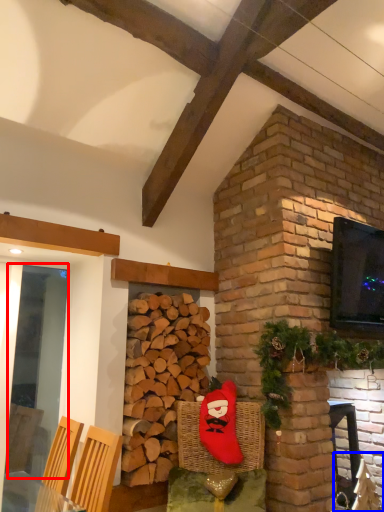
Question: Which object is closer to the camera taking this photo, glass door (highlighted by a red box) or armchair (highlighted by a blue box)?

Choices:
 (A) glass door
 (B) armchair

Answer: (A)